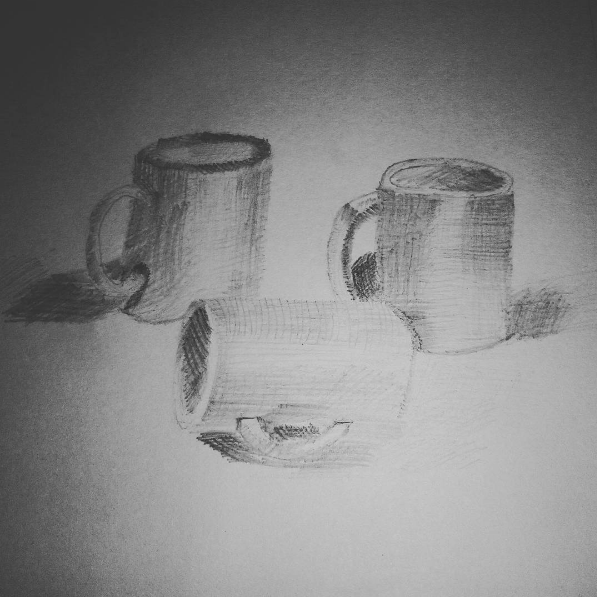
Find the location of `insides of cups`. insides of cups is located at coordinates pos(196,362), pos(202,155), pos(458,181).